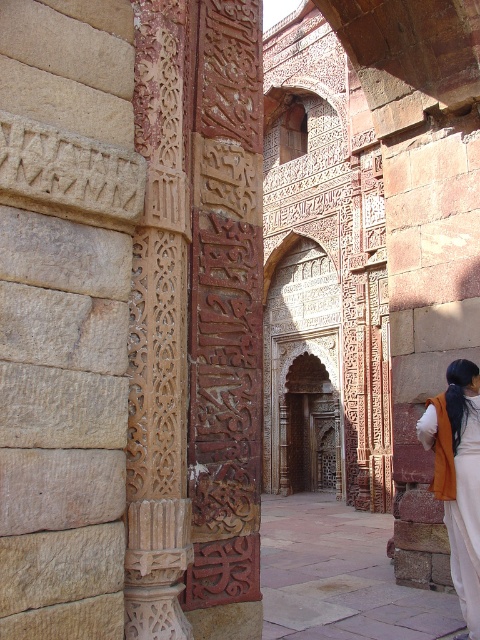
Question: Which object is positioned closest to the pink stone courtyard at center?

Choices:
 (A) carved stone inscription at center
 (B) orange cotton robe at right

Answer: (B)

Question: Is carved stone inscription at center positioned at the back of pink stone courtyard at center?

Choices:
 (A) yes
 (B) no

Answer: (B)

Question: Is carved stone inscription at center closer to the viewer compared to pink stone courtyard at center?

Choices:
 (A) yes
 (B) no

Answer: (A)

Question: Does pink stone courtyard at center have a greater width compared to orange cotton robe at right?

Choices:
 (A) yes
 (B) no

Answer: (A)

Question: Among these points, which one is farthest from the camera?

Choices:
 (A) (202, 362)
 (B) (346, 628)
 (C) (477, 636)

Answer: (B)

Question: Which point is farther to the camera?

Choices:
 (A) (276, 525)
 (B) (467, 509)

Answer: (A)